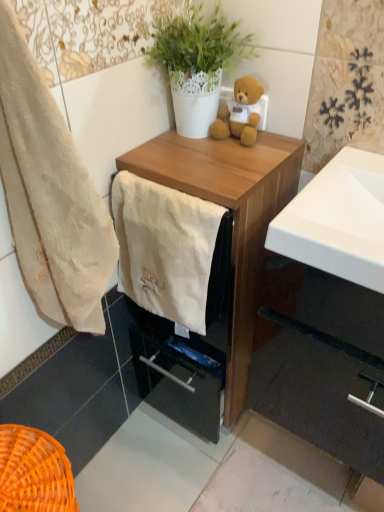
You are a GUI agent. You are given a task and a screenshot of the screen. Output one action in this format:
    pyautogui.click(x=<x>, y=<y>)
    Task: Click on the free point above wooden chest of drawers at center (from a real-world perspective)
    The image size is (384, 512).
    Given the screenshot: What is the action you would take?
    pyautogui.click(x=203, y=156)